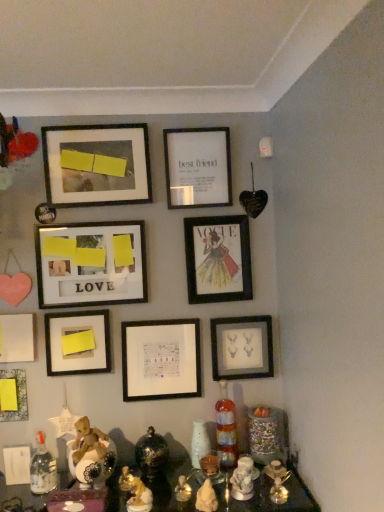
Question: From the image's perspective, is translucent glass bottle at lower left, which ranks as the 1th bottle in left-to-right order, under yellow matte paper at lower left, positioned as the fourth picture frame in bottom-to-top order?

Choices:
 (A) no
 (B) yes

Answer: (B)

Question: Is translucent glass bottle at lower left, the 1th bottle positioned from the front, to the left of yellow matte paper at lower left, acting as the sixth picture frame starting from the top, from the viewer's perspective?

Choices:
 (A) no
 (B) yes

Answer: (B)

Question: Is translucent glass bottle at lower left, placed as the second bottle when sorted from right to left, shorter than yellow matte paper at lower left, acting as the sixth picture frame starting from the top?

Choices:
 (A) yes
 (B) no

Answer: (A)

Question: Considering the relative sizes of translucent glass bottle at lower left, the 1th bottle positioned from the front, and yellow matte paper at lower left, positioned as the fourth picture frame in bottom-to-top order, in the image provided, is translucent glass bottle at lower left, the 1th bottle positioned from the front, bigger than yellow matte paper at lower left, positioned as the fourth picture frame in bottom-to-top order,?

Choices:
 (A) yes
 (B) no

Answer: (B)

Question: From a real-world perspective, is translucent glass bottle at lower left, which ranks as the 1th bottle in left-to-right order, under yellow matte paper at lower left, positioned as the fourth picture frame in bottom-to-top order?

Choices:
 (A) yes
 (B) no

Answer: (A)

Question: Is translucent glass bottle at lower left, which ranks as the second bottle in back-to-front order, taller than yellow matte paper at lower left, acting as the sixth picture frame starting from the top?

Choices:
 (A) yes
 (B) no

Answer: (B)

Question: From the image's perspective, is matte yellow paper at lower left, which appears as the 1th picture frame when ordered from the bottom, on matte wooden picture frame at center-left, positioned as the sixth picture frame in bottom-to-top order?

Choices:
 (A) no
 (B) yes

Answer: (A)

Question: Is matte wooden picture frame at center-left, positioned as the sixth picture frame in bottom-to-top order, located within matte yellow paper at lower left, which appears as the 9th picture frame when viewed from the top?

Choices:
 (A) no
 (B) yes

Answer: (A)

Question: Is matte yellow paper at lower left, which appears as the 1th picture frame when ordered from the bottom, closer to the viewer compared to matte wooden picture frame at center-left, which ranks as the 4th picture frame in top-to-bottom order?

Choices:
 (A) no
 (B) yes

Answer: (B)

Question: Is matte yellow paper at lower left, which appears as the 1th picture frame when ordered from the bottom, further to camera compared to matte wooden picture frame at center-left, which ranks as the 4th picture frame in top-to-bottom order?

Choices:
 (A) yes
 (B) no

Answer: (B)

Question: Can you confirm if matte yellow paper at lower left, which appears as the 1th picture frame when ordered from the bottom, is taller than matte wooden picture frame at center-left, which ranks as the 4th picture frame in top-to-bottom order?

Choices:
 (A) yes
 (B) no

Answer: (B)

Question: From a real-world perspective, is matte yellow paper at lower left, which appears as the 1th picture frame when ordered from the bottom, on matte wooden picture frame at center-left, positioned as the sixth picture frame in bottom-to-top order?

Choices:
 (A) no
 (B) yes

Answer: (A)

Question: Is matte wooden picture frame at center-left, which ranks as the 4th picture frame in top-to-bottom order, to the right of white matte picture frame at upper center, the first picture frame viewed from the top, from the viewer's perspective?

Choices:
 (A) yes
 (B) no

Answer: (B)